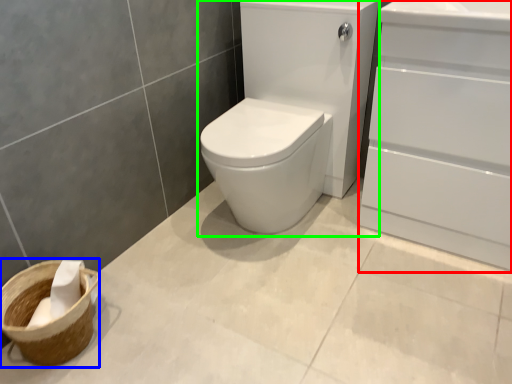
Question: Considering the real-world distances, which object is farthest from screen door (highlighted by a red box)? basket container (highlighted by a blue box) or sink (highlighted by a green box)?

Choices:
 (A) basket container
 (B) sink

Answer: (A)